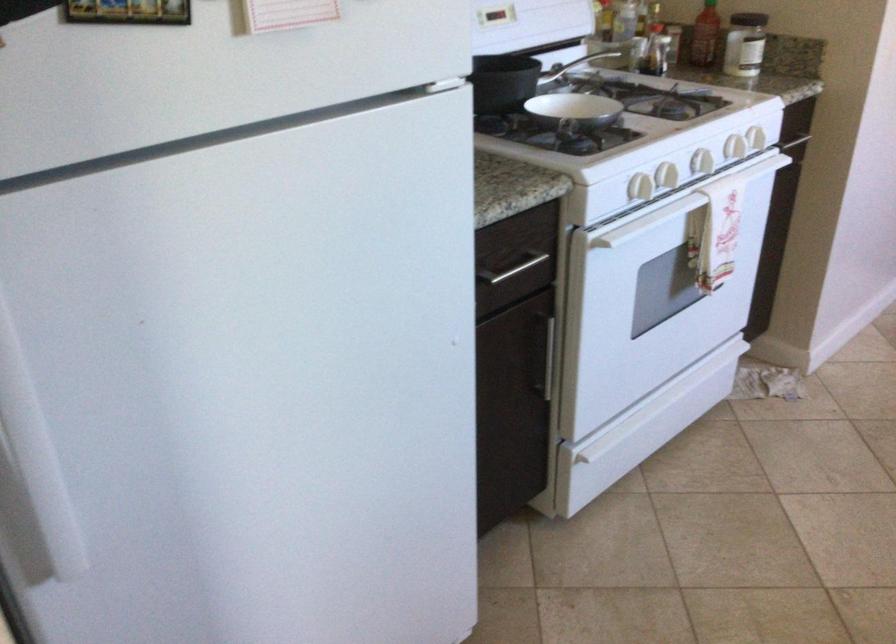
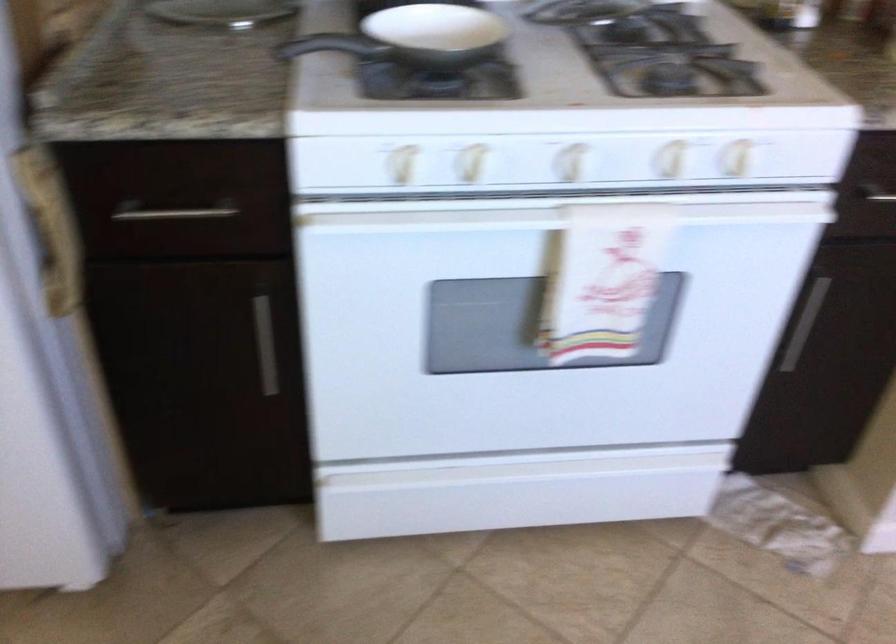
Find the pixel in the second image that matches point (549, 82) in the first image.

(436, 33)